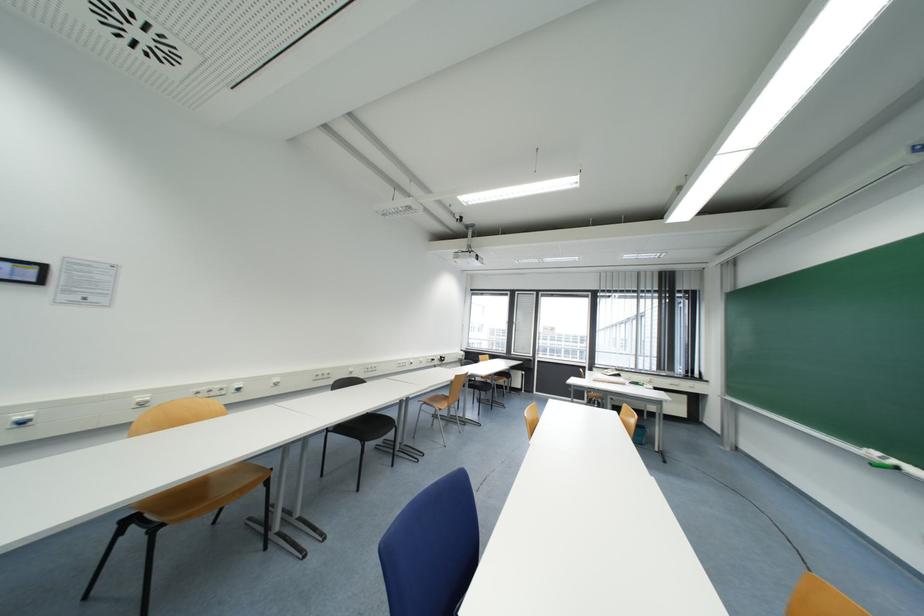
At what (x,y) coordinates should I click in order to perform the action: click on green chalkboard eraser. Please return your answer as a coordinate pair (x, y). The width and height of the screenshot is (924, 616). Looking at the image, I should click on (881, 460).